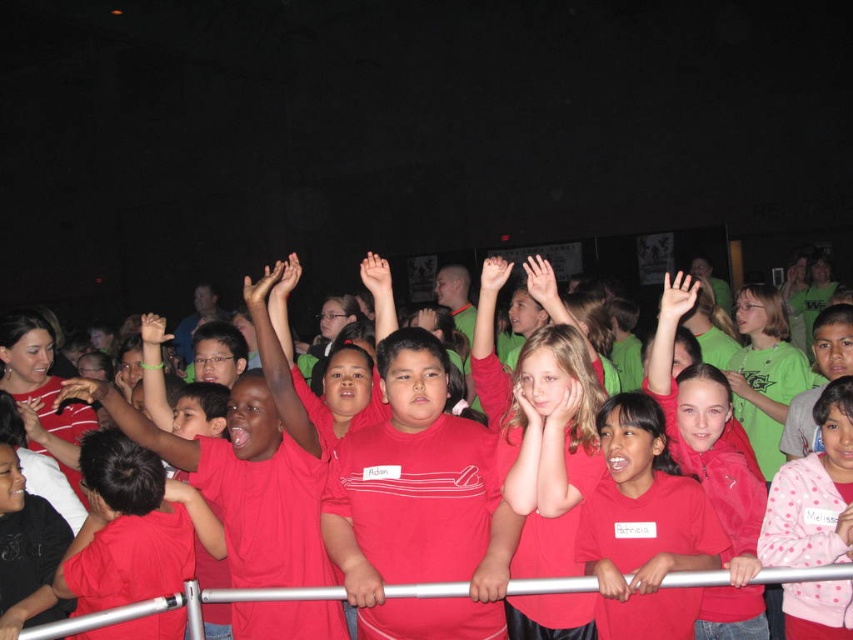
You are a photographer in a large hall and want to take a photo of the matte red shirt at center and the silver metallic rail at center. Which object should you focus on first if you want to capture both clearly in the same frame?

The matte red shirt at center has a larger size compared to the silver metallic rail at center, so you should focus on the matte red shirt at center first to ensure it is in focus, and the silver metallic rail at center will also be in focus due to its smaller size.

Consider the image. You are a photographer trying to capture a group photo of the children in the scene. You notice the matte red shirts at center and the silver metallic rail at center. Which object is positioned to the right side of the other?

The matte red shirts at center are to the right of the silver metallic rail at center.